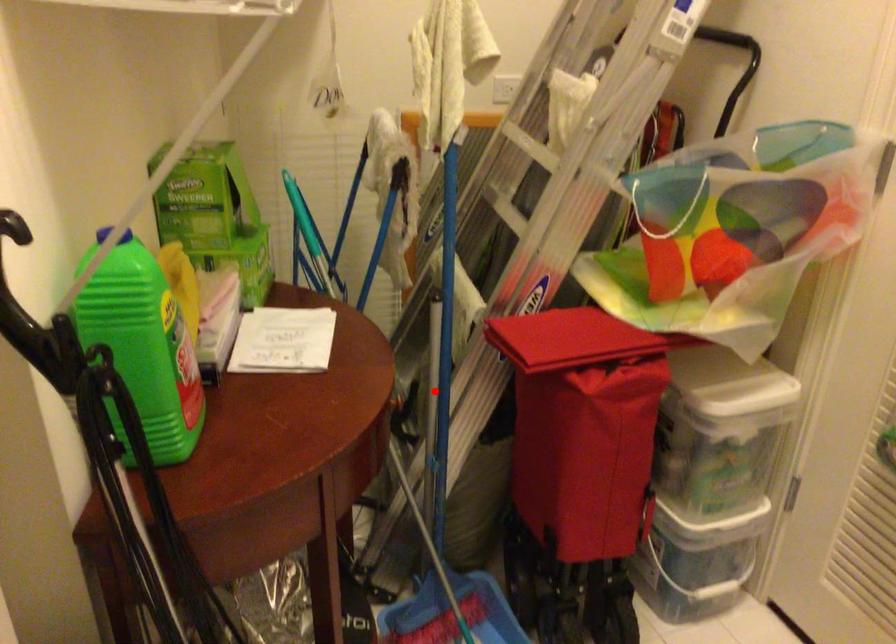
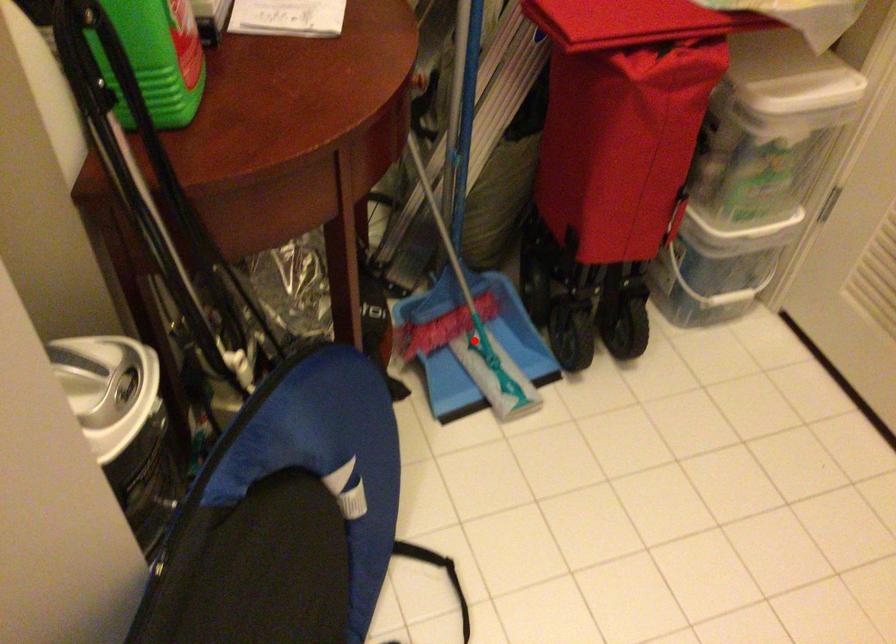
I am providing you with two images of the same scene from different viewpoints. A red point is marked on the first image and another point is marked on the second image. Do the highlighted points in image1 and image2 indicate the same real-world spot?

No